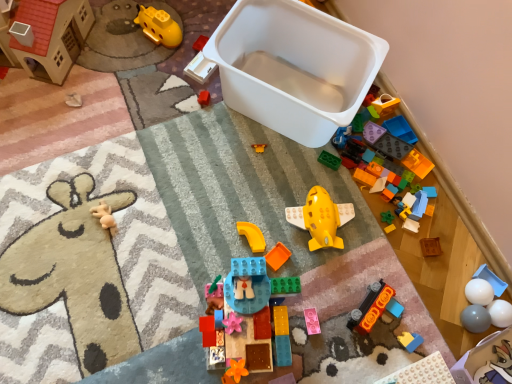
At what (x,y) coordinates should I click in order to perform the action: click on free space that is in between cardboard house at upper left, the 1th toy positioned from the left, and white plastic tray at upper center, acting as the fourth toy starting from the left. Please return your answer as a coordinate pair (x, y). Looking at the image, I should click on tap(130, 66).